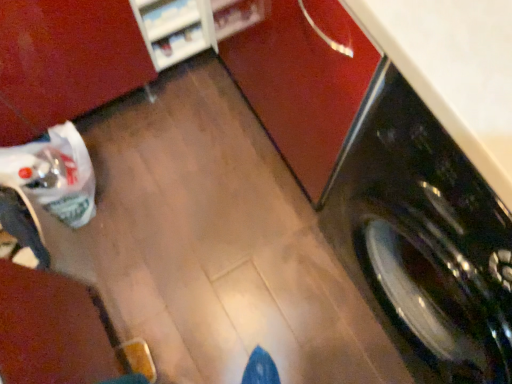
Question: In the image, is black glossy washing machine at right on the left side or the right side of white glossy shelf at upper left?

Choices:
 (A) right
 (B) left

Answer: (A)

Question: From a real-world perspective, is black glossy washing machine at right physically located above or below white glossy shelf at upper left?

Choices:
 (A) below
 (B) above

Answer: (B)

Question: From their relative heights in the image, would you say black glossy washing machine at right is taller or shorter than white glossy shelf at upper left?

Choices:
 (A) tall
 (B) short

Answer: (A)

Question: Based on their positions, is white glossy shelf at upper left located to the left or right of black glossy washing machine at right?

Choices:
 (A) right
 (B) left

Answer: (B)

Question: From a real-world perspective, relative to black glossy washing machine at right, is white glossy shelf at upper left vertically above or below?

Choices:
 (A) above
 (B) below

Answer: (B)

Question: Considering the positions of white glossy shelf at upper left and black glossy washing machine at right in the image, is white glossy shelf at upper left wider or thinner than black glossy washing machine at right?

Choices:
 (A) thin
 (B) wide

Answer: (A)

Question: Does point (169, 61) appear closer or farther from the camera than point (382, 278)?

Choices:
 (A) closer
 (B) farther

Answer: (B)